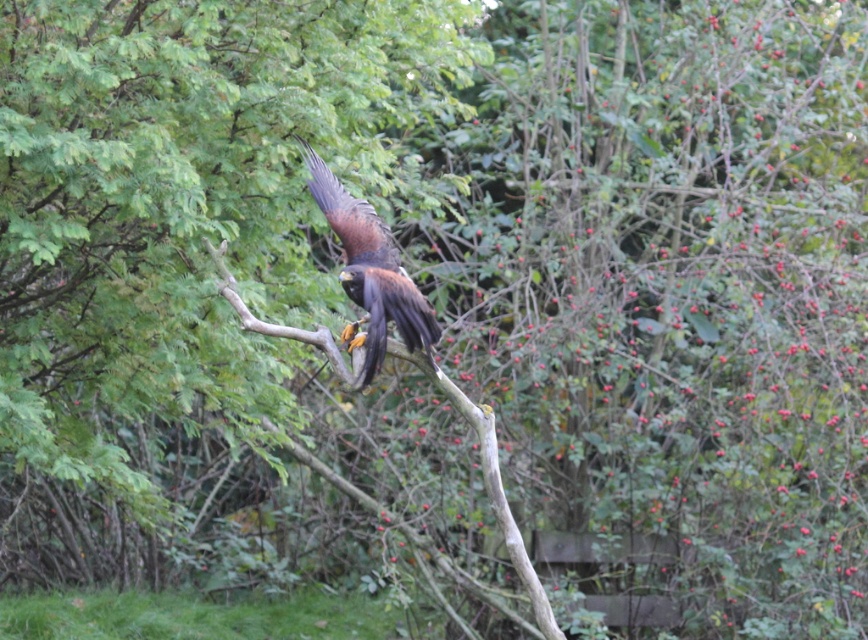
Question: Among these points, which one is nearest to the camera?

Choices:
 (A) (523, 621)
 (B) (331, 198)

Answer: (B)

Question: Does brown feathered eagle at center have a larger size compared to brown wood tree branch at center?

Choices:
 (A) no
 (B) yes

Answer: (A)

Question: Which point is closer to the camera?

Choices:
 (A) brown feathered eagle at center
 (B) brown wood tree branch at center

Answer: (A)

Question: Is brown feathered eagle at center smaller than brown wood tree branch at center?

Choices:
 (A) yes
 (B) no

Answer: (A)

Question: Considering the relative positions of brown feathered eagle at center and brown wood tree branch at center in the image provided, where is brown feathered eagle at center located with respect to brown wood tree branch at center?

Choices:
 (A) above
 (B) below

Answer: (A)

Question: Among these objects, which one is nearest to the camera?

Choices:
 (A) brown feathered eagle at center
 (B) brown wood tree branch at center

Answer: (A)